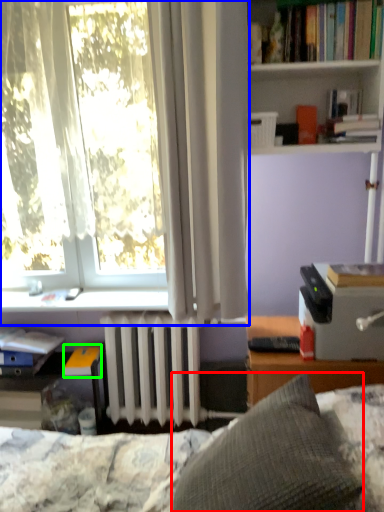
Question: Based on their relative distances, which object is farther from pillow (highlighted by a red box)? Choose from shelf (highlighted by a blue box) and book (highlighted by a green box).

Choices:
 (A) shelf
 (B) book

Answer: (B)